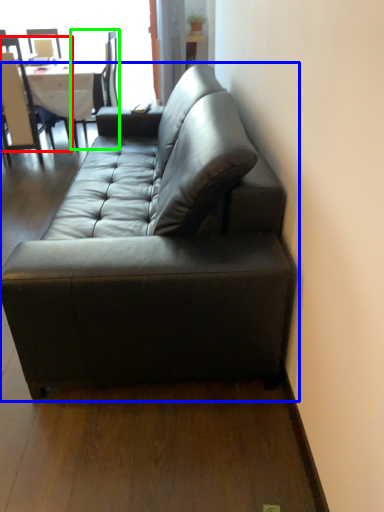
Question: Estimate the real-world distances between objects in this image. Which object is closer to chair (highlighted by a red box), studio couch (highlighted by a blue box) or chair (highlighted by a green box)?

Choices:
 (A) studio couch
 (B) chair

Answer: (B)